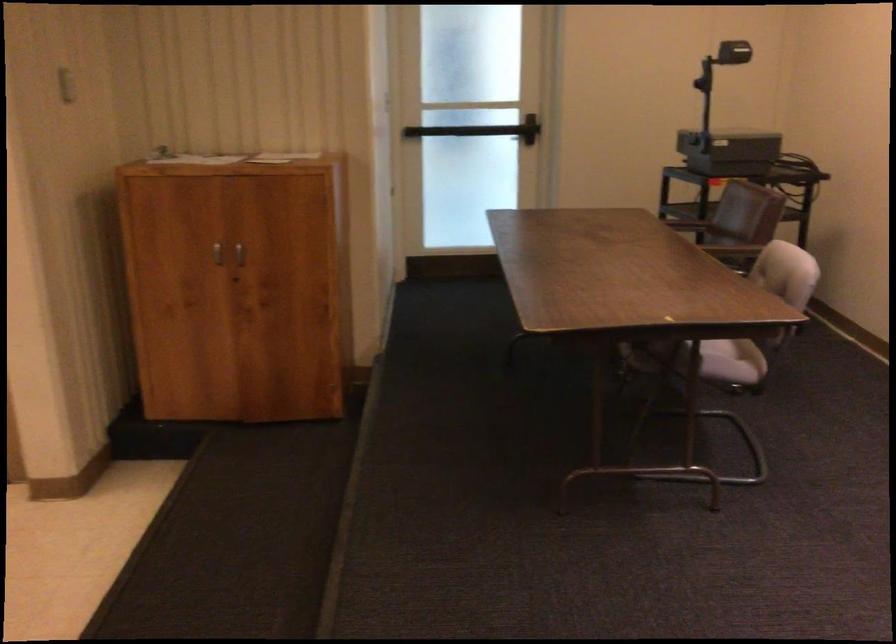
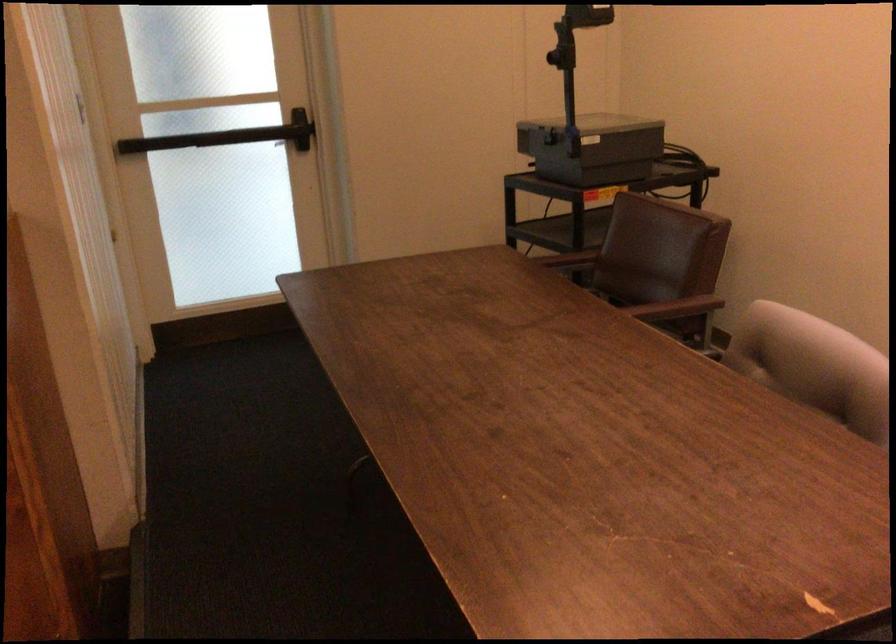
Where in the second image is the point corresponding to [741,252] from the first image?

(677, 308)